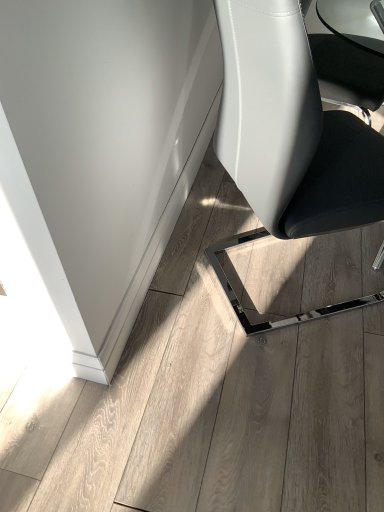
Question: Should I look upward or downward to see white leather chair at center?

Choices:
 (A) up
 (B) down

Answer: (A)